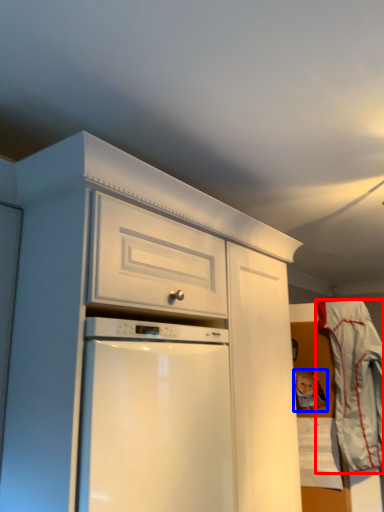
Question: Among these objects, which one is nearest to the camera, laundry (highlighted by a red box) or toy (highlighted by a blue box)?

Choices:
 (A) laundry
 (B) toy

Answer: (A)